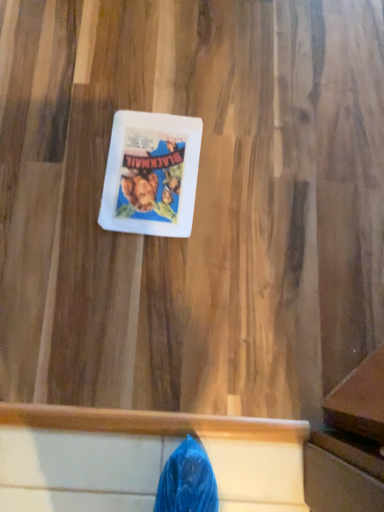
The width and height of the screenshot is (384, 512). What are the coordinates of `free space below white matte comic book at center (from a real-world perspective)` in the screenshot? It's located at (150, 174).